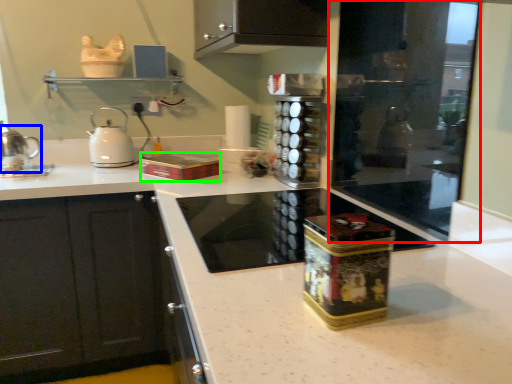
Question: Which is farther away from screen door (highlighted by a red box)? kitchen appliance (highlighted by a blue box) or box (highlighted by a green box)?

Choices:
 (A) kitchen appliance
 (B) box

Answer: (A)